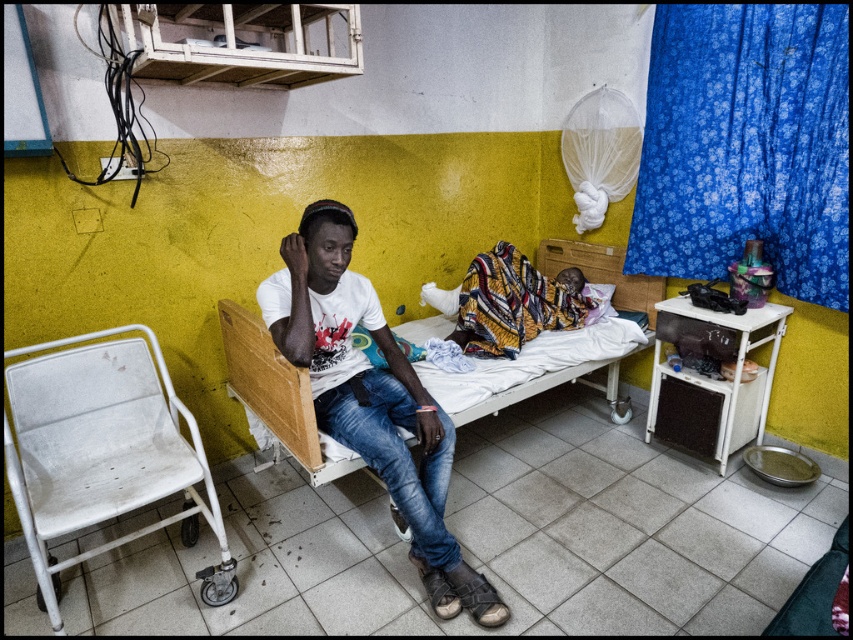
Question: Does white matte t-shirt at center have a larger size compared to printed fabric baby at center?

Choices:
 (A) yes
 (B) no

Answer: (A)

Question: Based on their relative distances, which object is nearer to the white matte t-shirt at center?

Choices:
 (A) printed fabric baby at center
 (B) white metal chair at lower left

Answer: (B)

Question: Is white metal chair at lower left to the left of printed fabric baby at center from the viewer's perspective?

Choices:
 (A) yes
 (B) no

Answer: (A)

Question: Is white matte t-shirt at center smaller than printed fabric baby at center?

Choices:
 (A) yes
 (B) no

Answer: (B)

Question: Estimate the real-world distances between objects in this image. Which object is farther from the printed fabric baby at center?

Choices:
 (A) white matte t-shirt at center
 (B) white metal chair at lower left

Answer: (B)

Question: Which of the following is the farthest from the observer?

Choices:
 (A) (288, 326)
 (B) (149, 488)

Answer: (B)